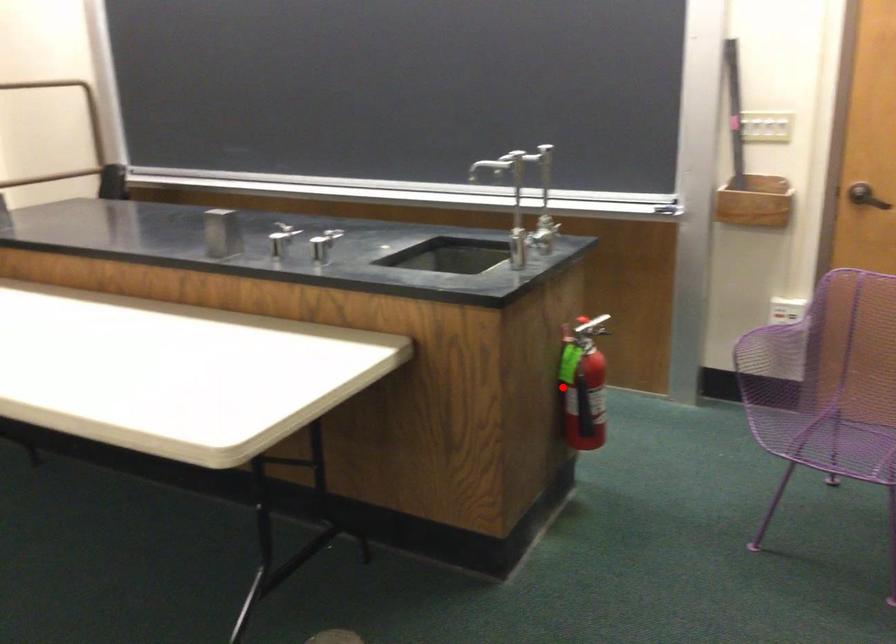
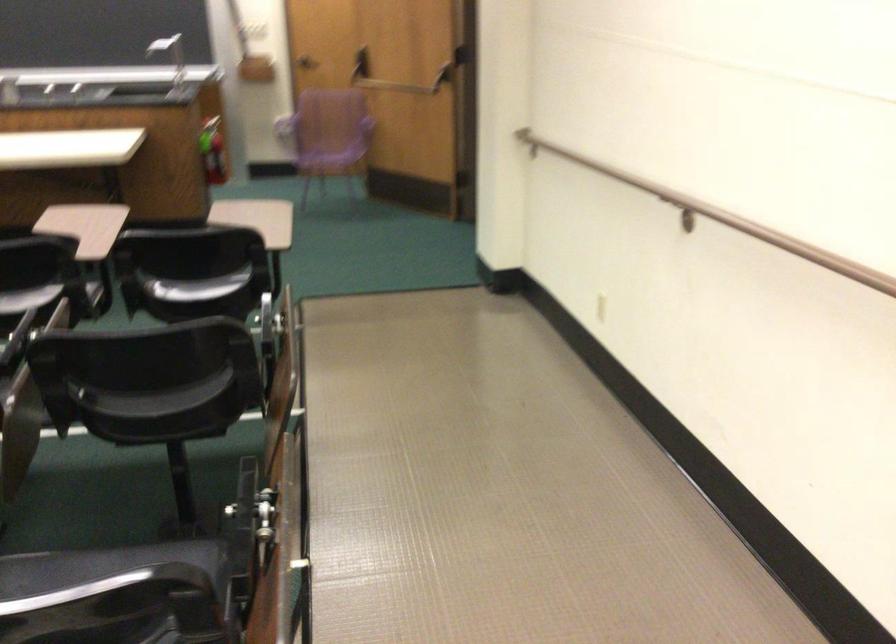
In the second image, find the point that corresponds to the highlighted location in the first image.

(212, 151)